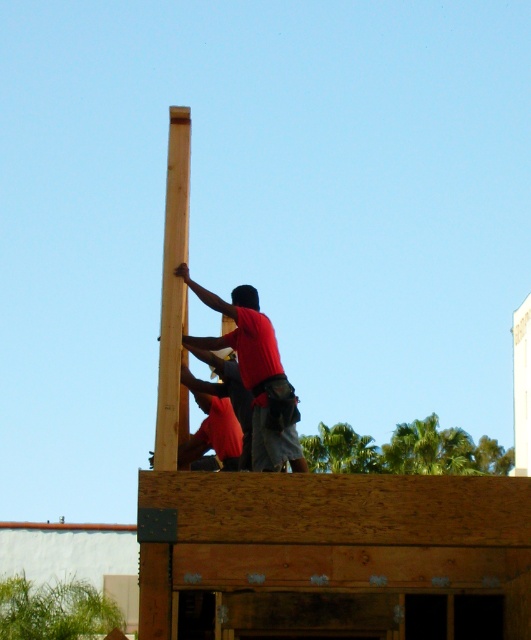
Who is lower down, light brown wood at center or red shirt at center?

red shirt at center

Can you confirm if light brown wood at center is positioned to the right of red shirt at center?

Incorrect, light brown wood at center is not on the right side of red shirt at center.

Is point (158, 372) positioned before point (209, 346)?

No, it is behind (209, 346).

Locate an element on the screen. Image resolution: width=531 pixels, height=640 pixels. light brown wood at center is located at coordinates (174, 296).